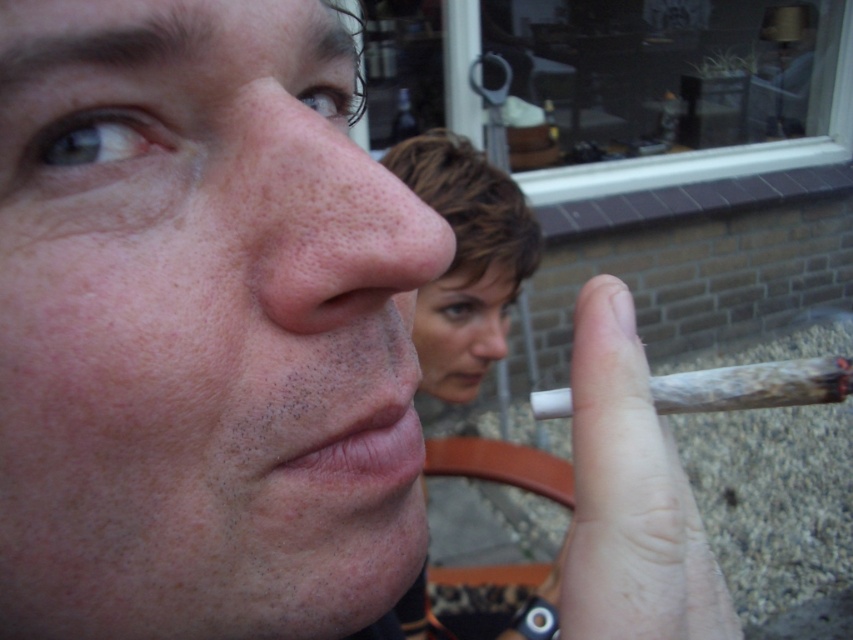
Does white matte cigarette at center have a greater height compared to smooth skin nose at center?

Indeed, white matte cigarette at center has a greater height compared to smooth skin nose at center.

Can you confirm if white matte cigarette at center is thinner than smooth skin nose at center?

Yes, white matte cigarette at center is thinner than smooth skin nose at center.

I want to click on white matte cigarette at center, so click(x=630, y=496).

The image size is (853, 640). Find the location of `white matte cigarette at center`. white matte cigarette at center is located at coordinates (630, 496).

Between pink flesh-colored nose at center and smooth skin nose at center, which one is positioned higher?

pink flesh-colored nose at center is higher up.

Does point (347, 262) come closer to viewer compared to point (505, 339)?

Yes.

Where is `pink flesh-colored nose at center`? The image size is (853, 640). pink flesh-colored nose at center is located at coordinates (326, 218).

Is point (659, 433) positioned behind point (338, 472)?

No, it is not.

Can you confirm if white matte cigarette at center is positioned above dry matte lips at lower center?

Indeed, white matte cigarette at center is positioned over dry matte lips at lower center.

Looking at this image, measure the distance between point (599, 573) and camera.

The distance of point (599, 573) from camera is 9.47 inches.

At what (x,y) coordinates should I click in order to perform the action: click on white matte cigarette at center. Please return your answer as a coordinate pair (x, y). The height and width of the screenshot is (640, 853). Looking at the image, I should click on (630, 496).